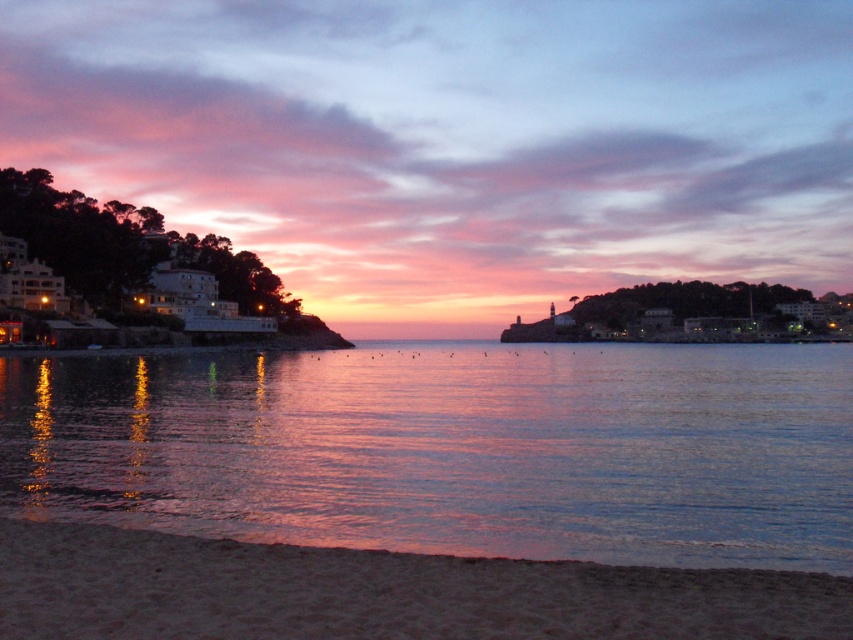
You are a photographer planning to capture the reflection of the sunset on the water. You are standing on the sandy beach at lower left. Which direction should you face to ensure the shiny reflective water at lower center is in your shot?

Since the shiny reflective water at lower center is located below the sandy beach at lower left, you should face downward or towards the water to capture the reflection.

You are standing on the sandy beach at lower left and want to walk to the shiny reflective water at lower center. Based on the scene description, which direction should you head towards?

The shiny reflective water at lower center is much taller than the sandy beach at lower left, so you should head towards the direction where the elevation increases to reach it.

You are standing on the beach in the image and want to walk towards the point labeled point (740, 468). Which direction should you walk relative to the point labeled point (396, 624)?

Since point (740, 468) is behind point (396, 624), you should walk in the direction away from point (396, 624) to reach point (740, 468).